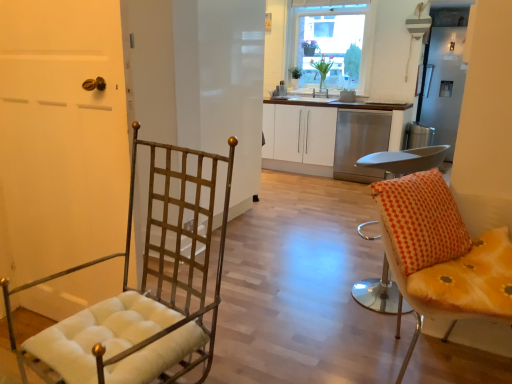
Locate an element on the screen. This screenshot has height=384, width=512. vacant space to the right of metallic grid screen door at center, which appears as the 1th screen door when viewed from the front is located at coordinates (292, 231).